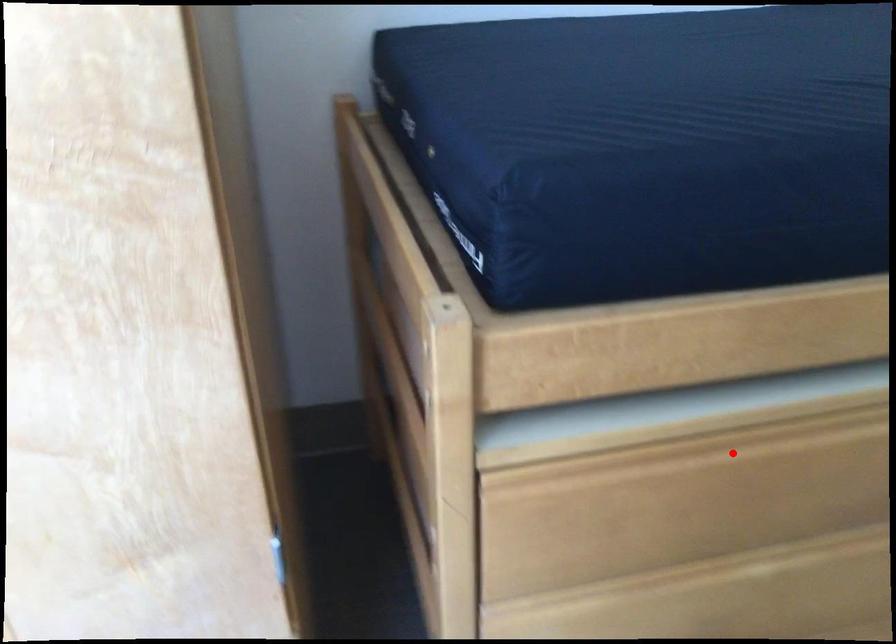
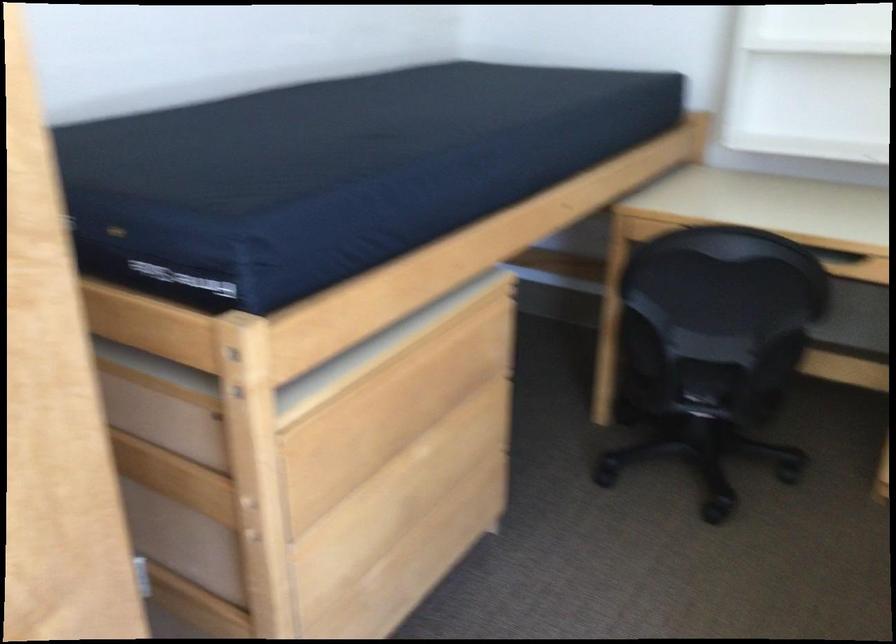
Question: I am providing you with two images of the same scene from different viewpoints. Image1 has a red point marked. In image2, the corresponding 3D location appears at what relative position? Reply with the corresponding letter.

Choices:
 (A) Closer
 (B) Farther

Answer: (B)